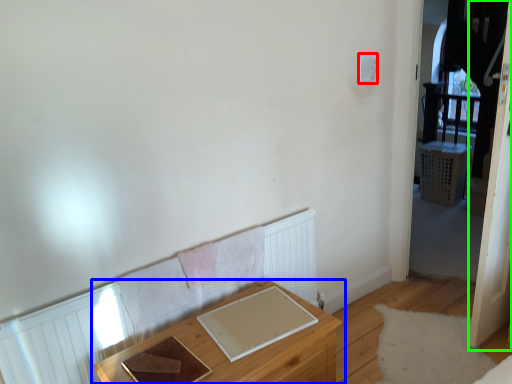
Question: Which object is the farthest from light switch (highlighted by a red box)? Choose among these: table (highlighted by a blue box) or screen door (highlighted by a green box).

Choices:
 (A) table
 (B) screen door

Answer: (A)